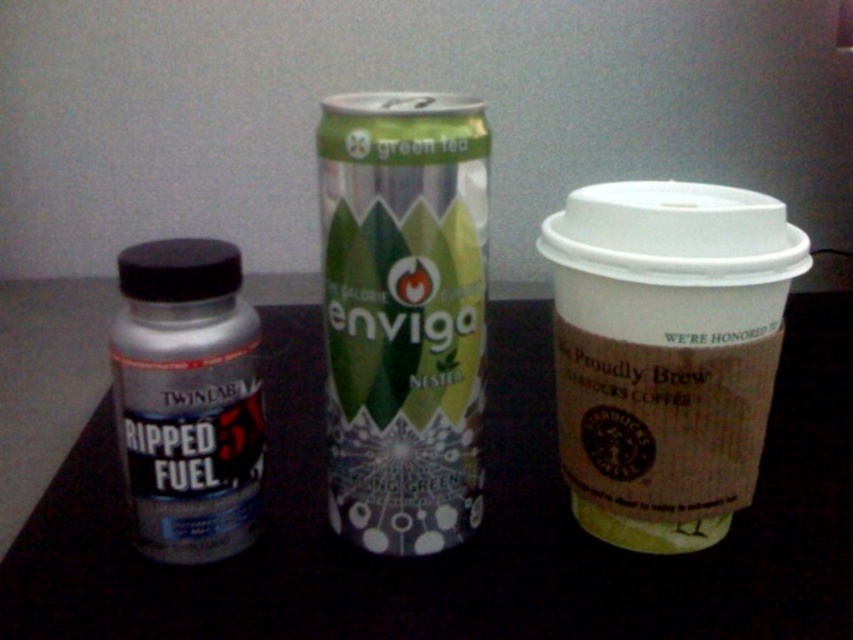
You are organizing items on a shelf and need to place the black plastic bottle at left and the green and silver can in the center. According to their positions, which item is closer to the left edge of the dark surface?

The black plastic bottle at left is closer to the left edge of the dark surface because it is positioned at point (x=473, y=532), which is further to the left compared to the green and silver can in the center.

You are organizing items on a table and see the black plastic bottle at left and the white paper cup at right. Which item is positioned higher up?

The black plastic bottle at left is located above the white paper cup at right, so it is positioned higher up.

Looking at this image, you have a black plastic bottle at left and a white paper cup at right in front of you. Which one has a greater width?

The black plastic bottle at left has a greater width than the white paper cup at right.